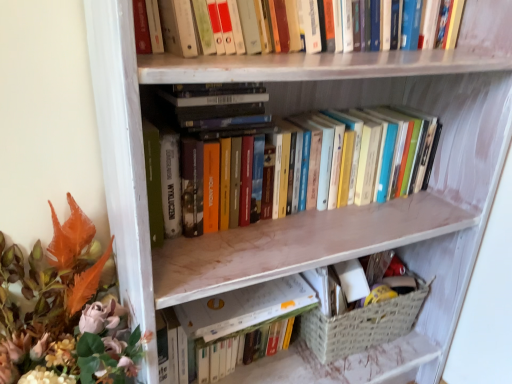
In order to face hardcover books at upper center, which is the second book from bottom to top, should I rotate leftwards or rightwards?

Turn right approximately 8.123 degrees to face it.

The height and width of the screenshot is (384, 512). I want to click on matte orange leaves at left, so [x=66, y=311].

At what (x,y) coordinates should I click in order to perform the action: click on hardcover book at center. Please return your answer as a coordinate pair (x, y). Looking at the image, I should click on (243, 307).

From the picture: Is hardcover books at center, which is the second book from top to bottom, smaller than hardcover book at center?

No, hardcover books at center, which is the second book from top to bottom, is not smaller than hardcover book at center.

Where is `paperback book lying behind the hardcover books at center, the 1th book from the bottom`? The height and width of the screenshot is (384, 512). paperback book lying behind the hardcover books at center, the 1th book from the bottom is located at coordinates (243, 307).

Can you confirm if hardcover books at center, the 1th book from the bottom, is wider than hardcover book at center?

Yes, hardcover books at center, the 1th book from the bottom, is wider than hardcover book at center.

Which is closer, (222, 135) or (229, 312)?

Point (222, 135) is closer to the camera than point (229, 312).

Is point (369, 335) farther from viewer compared to point (304, 98)?

Yes, point (369, 335) is farther from viewer.

From the picture: From the image's perspective, relative to hardcover books at center, which is the second book from top to bottom, is woven beige basket at lower right above or below?

Clearly, from the image's perspective, woven beige basket at lower right is below hardcover books at center, which is the second book from top to bottom.

Is woven beige basket at lower right turned away from hardcover books at center, which is the second book from top to bottom?

No, woven beige basket at lower right is not facing the opposite direction of hardcover books at center, which is the second book from top to bottom.

Which object is thinner, matte orange leaves at left or hardcover books at upper center, which is the second book from bottom to top?

Thinner between the two is hardcover books at upper center, which is the second book from bottom to top.

From the picture: From the image's perspective, between matte orange leaves at left and hardcover books at upper center, placed as the first book when sorted from top to bottom, who is located below?

matte orange leaves at left appears lower in the image.

Is matte orange leaves at left facing towards hardcover books at upper center, which is the second book from bottom to top?

No, matte orange leaves at left is not oriented towards hardcover books at upper center, which is the second book from bottom to top.

Is matte orange leaves at left shorter than hardcover books at upper center, which is the second book from bottom to top?

No, matte orange leaves at left is not shorter than hardcover books at upper center, which is the second book from bottom to top.

Is matte orange leaves at left positioned with its back to woven beige basket at lower right?

No, matte orange leaves at left is not facing the opposite direction of woven beige basket at lower right.

Considering the positions of objects matte orange leaves at left and woven beige basket at lower right in the image provided, who is in front, matte orange leaves at left or woven beige basket at lower right?

matte orange leaves at left is closer to the camera.

Which object is wider, matte orange leaves at left or woven beige basket at lower right?

matte orange leaves at left.

Is matte orange leaves at left taller than woven beige basket at lower right?

Indeed, matte orange leaves at left has a greater height compared to woven beige basket at lower right.

Is matte orange leaves at left beside hardcover books at center, the 1th book from the bottom?

matte orange leaves at left is not next to hardcover books at center, the 1th book from the bottom, and they're not touching.

Does matte orange leaves at left appear on the left side of hardcover books at center, the 1th book from the bottom?

Yes.

Is matte orange leaves at left aimed at hardcover books at center, the 1th book from the bottom?

No, matte orange leaves at left is not turned towards hardcover books at center, the 1th book from the bottom.

From the image's perspective, is hardcover books at upper center, placed as the first book when sorted from top to bottom, located above or below hardcover books at center, which is the second book from top to bottom?

hardcover books at upper center, placed as the first book when sorted from top to bottom, is above hardcover books at center, which is the second book from top to bottom.

Who is bigger, hardcover books at upper center, which is the second book from bottom to top, or hardcover books at center, the 1th book from the bottom?

hardcover books at center, the 1th book from the bottom.

Locate an element on the screen. The image size is (512, 384). book above the hardcover books at center, the 1th book from the bottom (from the image's perspective) is located at coordinates (404, 25).

How different are the orientations of hardcover books at upper center, which is the second book from bottom to top, and hardcover book at center in degrees?

The angular difference between hardcover books at upper center, which is the second book from bottom to top, and hardcover book at center is 3.03 degrees.

From the image's perspective, which is below, hardcover books at upper center, which is the second book from bottom to top, or hardcover book at center?

hardcover book at center.

Considering the relative positions of hardcover books at upper center, which is the second book from bottom to top, and hardcover book at center in the image provided, is hardcover books at upper center, which is the second book from bottom to top, to the left of hardcover book at center from the viewer's perspective?

No.

From the picture: Which object is closer to the camera, hardcover books at upper center, which is the second book from bottom to top, or hardcover book at center?

hardcover books at upper center, which is the second book from bottom to top, is in front.

From the image's perspective, which book is the 1st one above the hardcover book at center? Please provide its 2D coordinates.

[(319, 102)]

Where is `basket on the right of hardcover books at center, the 1th book from the bottom`? The width and height of the screenshot is (512, 384). basket on the right of hardcover books at center, the 1th book from the bottom is located at coordinates (362, 325).

Based on their spatial positions, is woven beige basket at lower right or hardcover book at center closer to hardcover books at center, the 1th book from the bottom?

hardcover book at center.

Which object lies nearer to the anchor point hardcover book at center, woven beige basket at lower right or hardcover books at upper center, which is the second book from bottom to top?

The object closer to hardcover book at center is woven beige basket at lower right.

Considering their positions, is hardcover books at upper center, placed as the first book when sorted from top to bottom, positioned closer to hardcover book at center than woven beige basket at lower right?

woven beige basket at lower right.

Based on their spatial positions, is matte orange leaves at left or hardcover books at upper center, which is the second book from bottom to top, further from woven beige basket at lower right?

hardcover books at upper center, which is the second book from bottom to top, is further to woven beige basket at lower right.

When comparing their distances from matte orange leaves at left, does woven beige basket at lower right or hardcover books at upper center, which is the second book from bottom to top, seem closer?

hardcover books at upper center, which is the second book from bottom to top, lies closer to matte orange leaves at left than the other object.

From the image, which object appears to be nearer to hardcover books at center, which is the second book from top to bottom, hardcover book at center or woven beige basket at lower right?

hardcover book at center is closer to hardcover books at center, which is the second book from top to bottom.

Estimate the real-world distances between objects in this image. Which object is closer to hardcover books at center, which is the second book from top to bottom, matte orange leaves at left or hardcover book at center?

The object closer to hardcover books at center, which is the second book from top to bottom, is hardcover book at center.

When comparing their distances from hardcover books at upper center, placed as the first book when sorted from top to bottom, does hardcover books at center, which is the second book from top to bottom, or woven beige basket at lower right seem closer?

Based on the image, hardcover books at center, which is the second book from top to bottom, appears to be nearer to hardcover books at upper center, placed as the first book when sorted from top to bottom.

Locate an element on the screen. basket between hardcover books at upper center, which is the second book from bottom to top, and matte orange leaves at left in the up-down direction is located at coordinates (362, 325).

Identify the location of basket between hardcover books at upper center, placed as the first book when sorted from top to bottom, and hardcover book at center from top to bottom. (362, 325).

This screenshot has height=384, width=512. I want to click on book between hardcover books at upper center, which is the second book from bottom to top, and woven beige basket at lower right in the up-down direction, so click(x=319, y=102).

Identify the location of basket between hardcover books at center, which is the second book from top to bottom, and hardcover book at center from top to bottom. (362, 325).